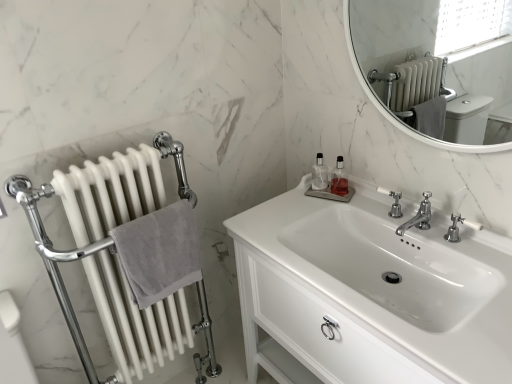
The height and width of the screenshot is (384, 512). What are the coordinates of `free space between polished chrome faucet at right, the second tap when ordered from left to right, and polished chrome faucet at center, the 2th tap when ordered from right to left` in the screenshot? It's located at (440, 246).